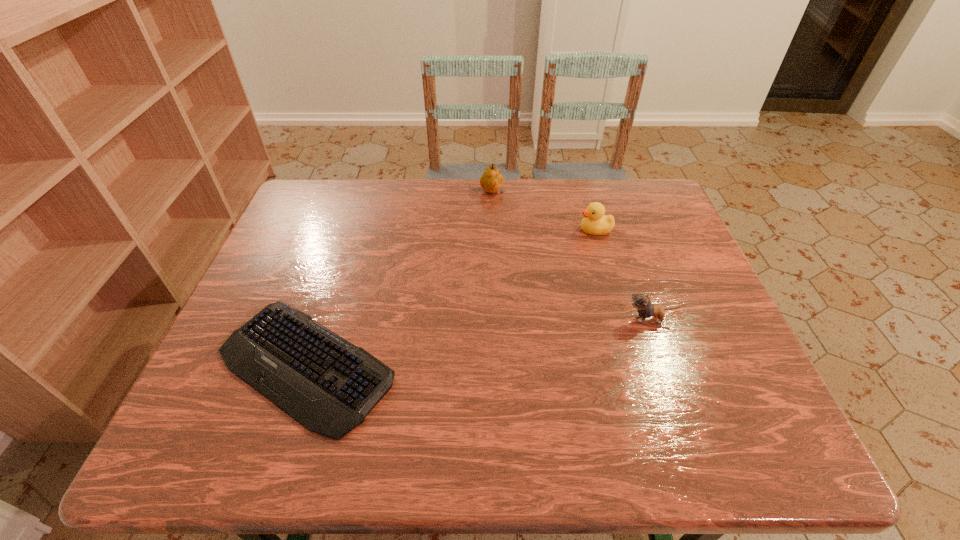
Locate an element on the screen. The width and height of the screenshot is (960, 540). vacant space at the far edge of the desktop is located at coordinates (378, 186).

Identify the location of free space at the left edge. (274, 296).

Where is `free space at the right edge of the desktop`? The width and height of the screenshot is (960, 540). free space at the right edge of the desktop is located at coordinates (657, 266).

Find the location of a particular element. free space at the far left corner of the desktop is located at coordinates (293, 221).

Locate an element on the screen. vacant space at the near left corner is located at coordinates (237, 432).

You are a GUI agent. You are given a task and a screenshot of the screen. Output one action in this format:
    pyautogui.click(x=<x>, y=<y>)
    Task: Click on the vacant space at the near right corner of the desktop
    The height and width of the screenshot is (540, 960).
    Given the screenshot: What is the action you would take?
    pyautogui.click(x=706, y=449)

Where is `free space between the kitten and the shortest object`? The width and height of the screenshot is (960, 540). free space between the kitten and the shortest object is located at coordinates (478, 342).

Locate an element on the screen. vacant space that is in between the farthest object and the leftmost object is located at coordinates (398, 279).

Identify the location of free spot between the duck and the second object from left to right. (543, 212).

Find the location of `empty location between the kitten and the leftmost object`. empty location between the kitten and the leftmost object is located at coordinates (478, 342).